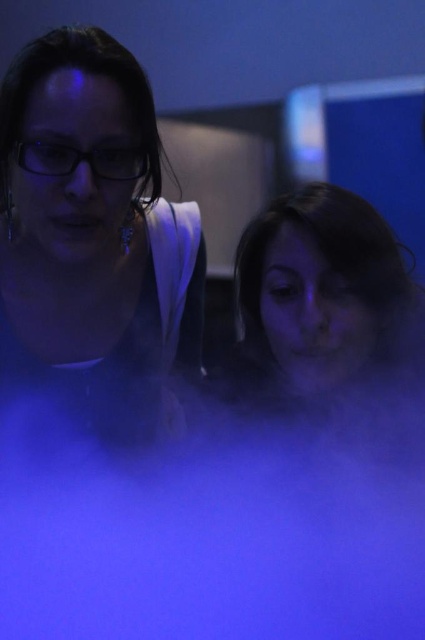
Question: Which object appears closest to the camera in this image?

Choices:
 (A) matte skin at center
 (B) matte black hair at left

Answer: (B)

Question: Is matte black hair at left further to camera compared to matte skin at center?

Choices:
 (A) no
 (B) yes

Answer: (A)

Question: Observing the image, what is the correct spatial positioning of matte black hair at left in reference to matte skin at center?

Choices:
 (A) left
 (B) right

Answer: (A)

Question: Does matte black hair at left have a smaller size compared to matte skin at center?

Choices:
 (A) no
 (B) yes

Answer: (A)